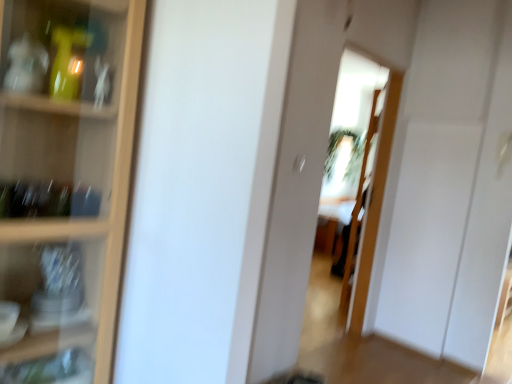
Where is `transparent glass screen door at center`? The width and height of the screenshot is (512, 384). transparent glass screen door at center is located at coordinates (374, 201).

What do you see at coordinates (374, 201) in the screenshot? The image size is (512, 384). I see `transparent glass screen door at center` at bounding box center [374, 201].

In order to face transparent glass screen door at center, should I rotate leftwards or rightwards?

You should look right and rotate roughly 14.530 degrees.

Where is `transparent glass screen door at center`? The height and width of the screenshot is (384, 512). transparent glass screen door at center is located at coordinates (374, 201).